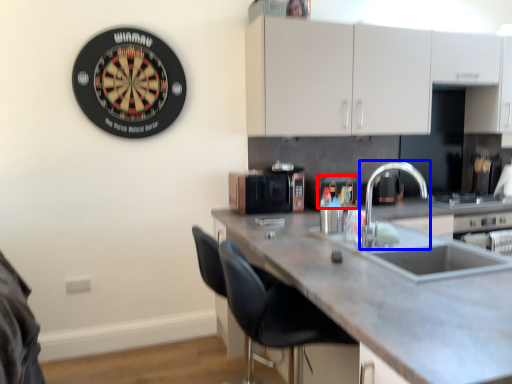
Question: Which object appears closest to the camera in this image, appliance (highlighted by a red box) or tap (highlighted by a blue box)?

Choices:
 (A) appliance
 (B) tap

Answer: (B)